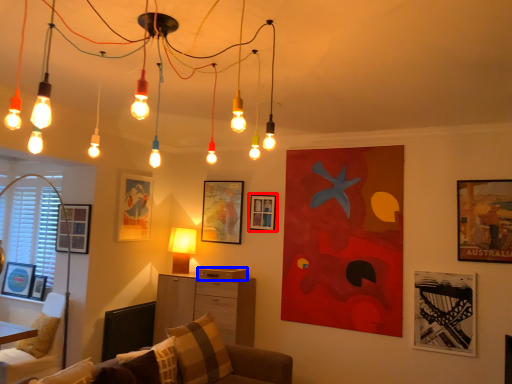
Question: Which point is further to the camera, picture frame (highlighted by a red box) or drawer (highlighted by a blue box)?

Choices:
 (A) picture frame
 (B) drawer

Answer: (A)